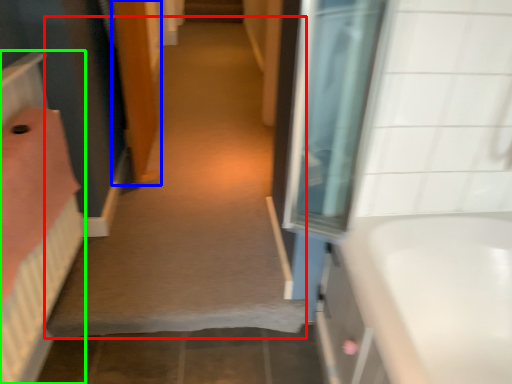
Question: Which object is positioned farthest from plain (highlighted by a red box)? Select from door (highlighted by a blue box) and bed (highlighted by a green box).

Choices:
 (A) door
 (B) bed

Answer: (B)